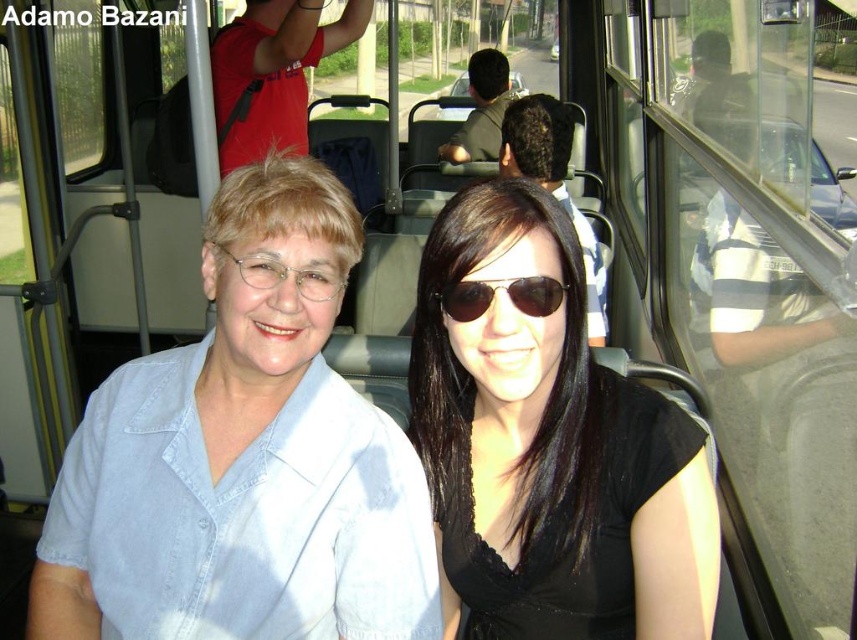
Is point (267, 113) farther from viewer compared to point (484, 305)?

Yes, it is behind point (484, 305).

Based on the photo, measure the distance between point (262, 49) and camera.

A distance of 8.17 feet exists between point (262, 49) and camera.

Where is `red t-shirt at upper center`? The height and width of the screenshot is (640, 857). red t-shirt at upper center is located at coordinates (273, 72).

This screenshot has width=857, height=640. I want to click on dark brown leather jacket at center, so click(481, 109).

Is dark brown leather jacket at center thinner than sunglasses at center?

No.

Who is more forward, (502,109) or (548,305)?

Positioned in front is point (548,305).

The width and height of the screenshot is (857, 640). In order to click on dark brown leather jacket at center in this screenshot , I will do `click(481, 109)`.

Between red t-shirt at upper center and dark brown hair at center, which one is positioned higher?

Positioned higher is red t-shirt at upper center.

Who is lower down, red t-shirt at upper center or dark brown hair at center?

dark brown hair at center is lower down.

This screenshot has height=640, width=857. What do you see at coordinates (273, 72) in the screenshot?
I see `red t-shirt at upper center` at bounding box center [273, 72].

Locate an element on the screen. red t-shirt at upper center is located at coordinates (273, 72).